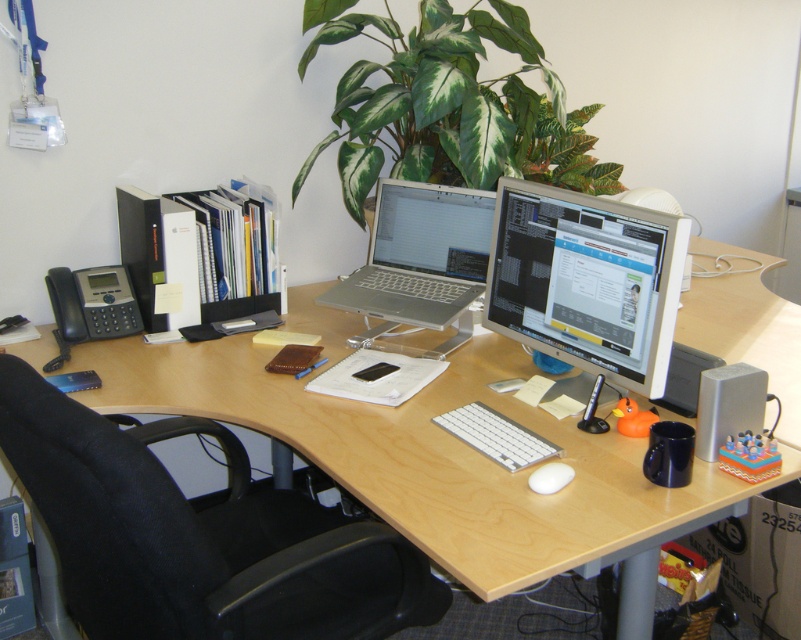
Question: Can you confirm if light wood computer desk at center is smaller than satin silver laptop at center?

Choices:
 (A) yes
 (B) no

Answer: (B)

Question: Which of the following is the farthest from the observer?

Choices:
 (A) (123, 609)
 (B) (453, 220)
 (C) (608, 364)
 (D) (552, 472)

Answer: (B)

Question: Is satin silver laptop at center below white matte mouse at center?

Choices:
 (A) no
 (B) yes

Answer: (A)

Question: Among these points, which one is nearest to the camera?

Choices:
 (A) (502, 323)
 (B) (401, 186)
 (C) (542, 488)
 (D) (168, 413)

Answer: (C)

Question: Does black fabric swivel chair at left have a smaller size compared to green leafy plant at upper center?

Choices:
 (A) no
 (B) yes

Answer: (B)

Question: Which of these objects is positioned closest to the green leafy plant at upper center?

Choices:
 (A) silver metallic monitor at center right
 (B) light wood computer desk at center
 (C) silver metallic laptop at center

Answer: (C)